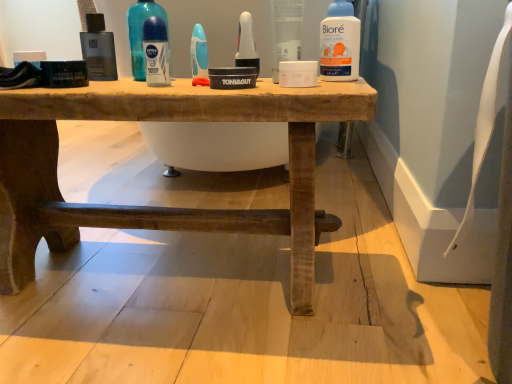
Question: From a real-world perspective, is blue glossy deodorant at upper center, the first cleaning product in the left-to-right sequence, physically located above or below rustic wood table at center?

Choices:
 (A) below
 (B) above

Answer: (B)

Question: In the image, is blue glossy deodorant at upper center, which is counted as the first cleaning product, starting from the back, positioned in front of or behind rustic wood table at center?

Choices:
 (A) behind
 (B) front

Answer: (A)

Question: Estimate the real-world distances between objects in this image. Which object is farther from the white plastic biore at upper center, the second cleaning product positioned from the left?

Choices:
 (A) blue glossy mouthwash at center, the 3th mouthwash viewed from the left
 (B) white matte jar at center
 (C) blue glossy deodorant at upper center, which is counted as the first cleaning product, starting from the back
 (D) white plastic toothbrush at center, the 4th mouthwash in the left-to-right sequence
 (E) transparent plastic deodorant at center, the 2th mouthwash viewed from the left

Answer: (C)

Question: Considering the real-world distances, which object is farthest from the matte black bottle at upper left, the fourth mouthwash in the right-to-left sequence?

Choices:
 (A) white plastic biore at upper center, the 2th cleaning product viewed from the back
 (B) white matte jar at center
 (C) white plastic toothbrush at center, the 4th mouthwash in the left-to-right sequence
 (D) blue glossy mouthwash at center, the 2th mouthwash viewed from the right
 (E) transparent plastic deodorant at center, the 3th mouthwash positioned from the right

Answer: (A)